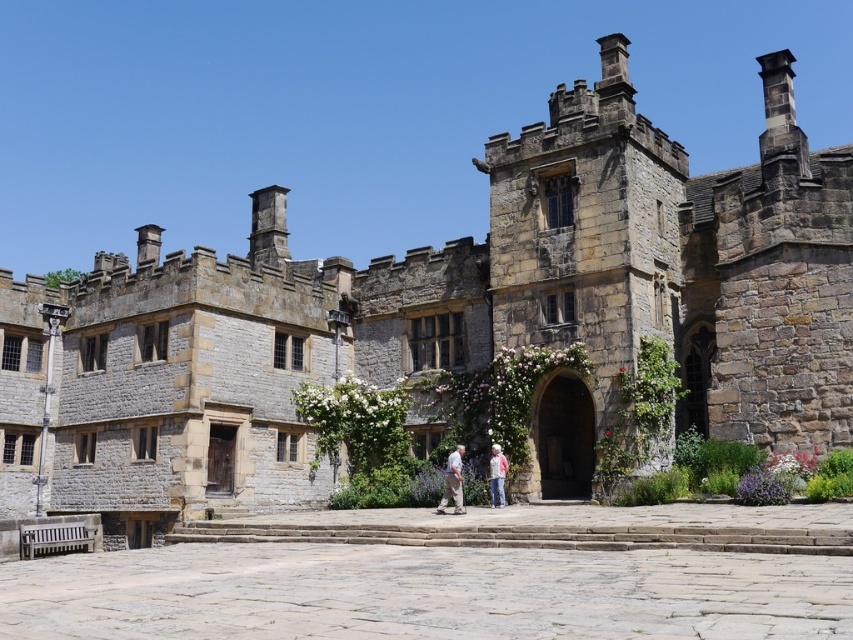
Is point (451, 492) in front of point (498, 499)?

Yes, it is in front of point (498, 499).

Between light pink fabric at center and pink fabric jacket at center, which one has less height?

pink fabric jacket at center is shorter.

The width and height of the screenshot is (853, 640). Find the location of `light pink fabric at center`. light pink fabric at center is located at coordinates (453, 483).

Locate an element on the screen. The height and width of the screenshot is (640, 853). light pink fabric at center is located at coordinates (453, 483).

What do you see at coordinates (453, 483) in the screenshot?
I see `light pink fabric at center` at bounding box center [453, 483].

Which is in front, point (450, 483) or point (444, 492)?

Point (450, 483)

The height and width of the screenshot is (640, 853). In order to click on light pink fabric at center in this screenshot , I will do `click(453, 483)`.

Between point (450, 461) and point (492, 493), which one is positioned in front?

Point (450, 461)

Find the location of `light beige fabric pants at center`. light beige fabric pants at center is located at coordinates pyautogui.click(x=451, y=483).